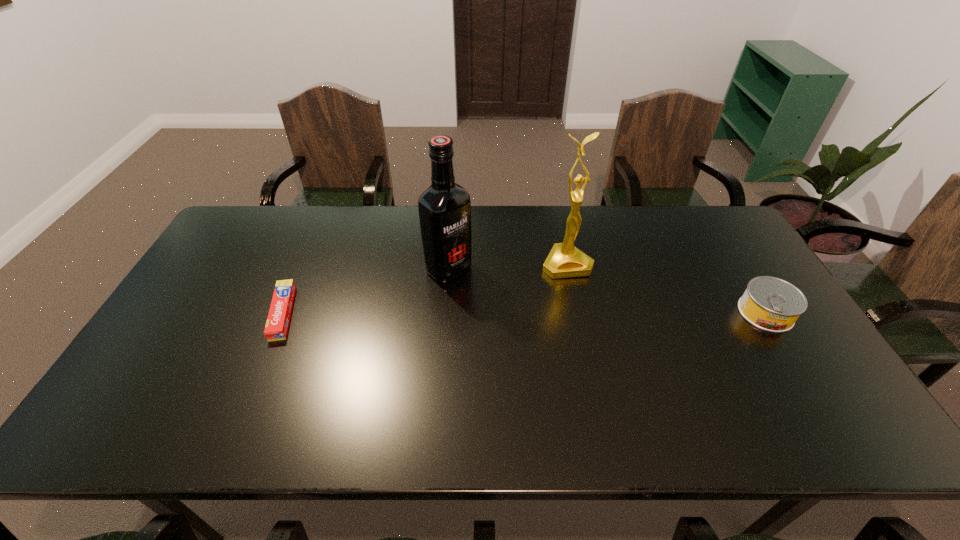
Identify which object is located as the third nearest to the liquor. Please provide its 2D coordinates. Your answer should be formatted as a tuple, i.e. [(x, y)], where the tuple contains the x and y coordinates of a point satisfying the conditions above.

[(771, 304)]

The width and height of the screenshot is (960, 540). I want to click on the third closest object to the leftmost object, so click(771, 304).

Locate an element on the screen. free space in the image that satisfies the following two spatial constraints: 1. on the front side of the second object from left to right; 2. on the right side of the rightmost object is located at coordinates click(445, 313).

Identify the location of vacant space that satisfies the following two spatial constraints: 1. on the back side of the shortest object; 2. on the right side of the second object from left to right. This screenshot has width=960, height=540. (301, 269).

This screenshot has width=960, height=540. Find the location of `vacant point that satisfies the following two spatial constraints: 1. on the back side of the toothpaste; 2. on the right side of the third object from left to right`. vacant point that satisfies the following two spatial constraints: 1. on the back side of the toothpaste; 2. on the right side of the third object from left to right is located at coordinates (304, 264).

At what (x,y) coordinates should I click in order to perform the action: click on free space that satisfies the following two spatial constraints: 1. on the back side of the award; 2. on the left side of the liquor. Please return your answer as a coordinate pair (x, y). This screenshot has height=540, width=960. Looking at the image, I should click on (449, 264).